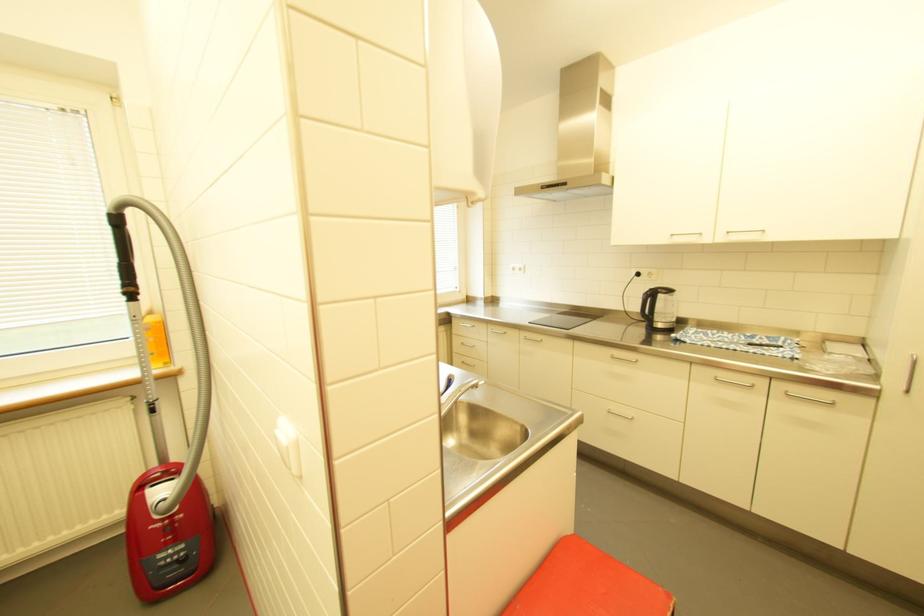
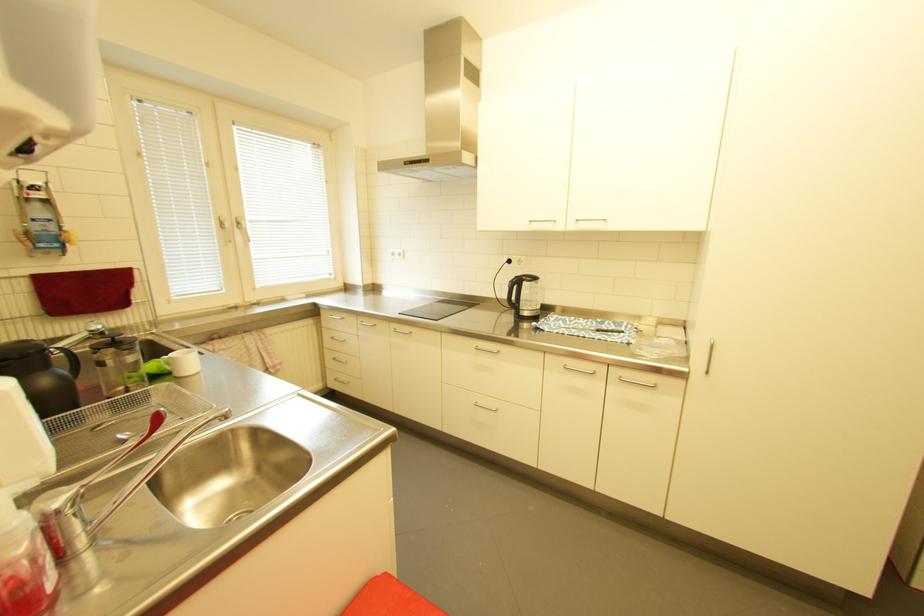
Question: How did the camera likely rotate?

Choices:
 (A) Left
 (B) Right
 (C) Up
 (D) Down

Answer: (B)